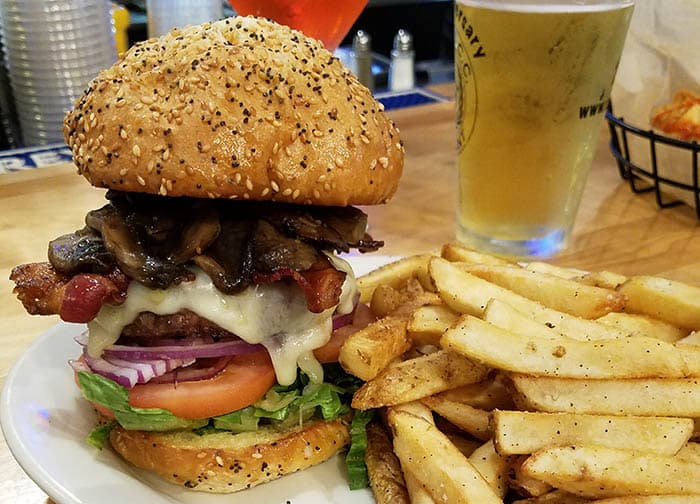
In order to click on bar mat in this screenshot , I will do `click(393, 100)`.